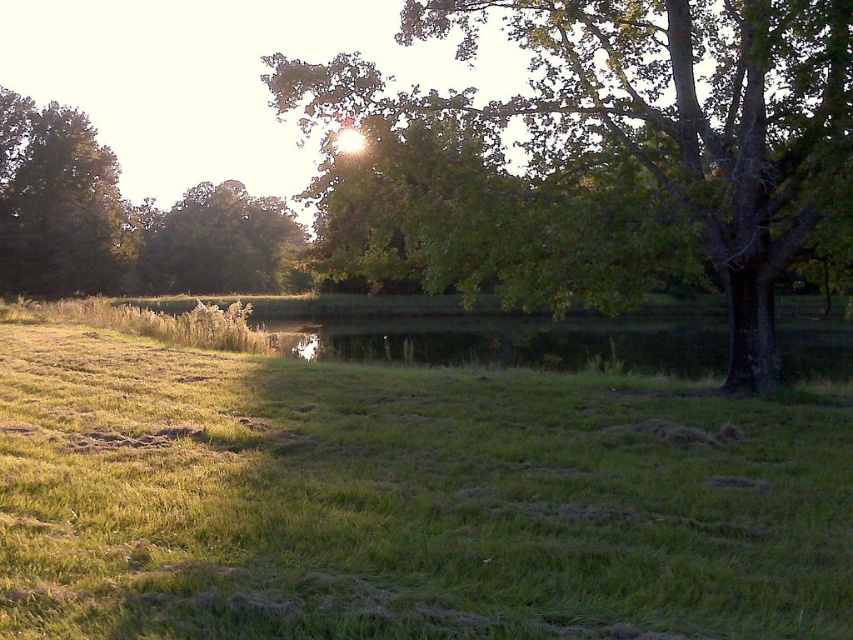
Which of these two, green leafy tree at upper right or green leafy tree at left, stands taller?

Standing taller between the two is green leafy tree at upper right.

Does green leafy tree at upper right have a greater height compared to green leafy tree at left?

Yes, green leafy tree at upper right is taller than green leafy tree at left.

In order to click on green leafy tree at upper right in this screenshot , I will do `click(642, 134)`.

Between green leafy tree at left and green leafy tree at upper left, which one is positioned lower?

green leafy tree at upper left

Is green leafy tree at left smaller than green leafy tree at upper left?

Yes, green leafy tree at left is smaller than green leafy tree at upper left.

Does point (25, 262) come behind point (227, 236)?

No, it is in front of (227, 236).

The height and width of the screenshot is (640, 853). Identify the location of green leafy tree at left. (57, 204).

Based on the photo, does green leafy tree at upper right have a greater height compared to green leafy tree at upper left?

Yes.

Can you confirm if green leafy tree at upper right is positioned to the left of green leafy tree at upper left?

In fact, green leafy tree at upper right is to the right of green leafy tree at upper left.

Locate an element on the screen. This screenshot has width=853, height=640. green leafy tree at upper right is located at coordinates (642, 134).

This screenshot has height=640, width=853. I want to click on green leafy tree at upper right, so click(642, 134).